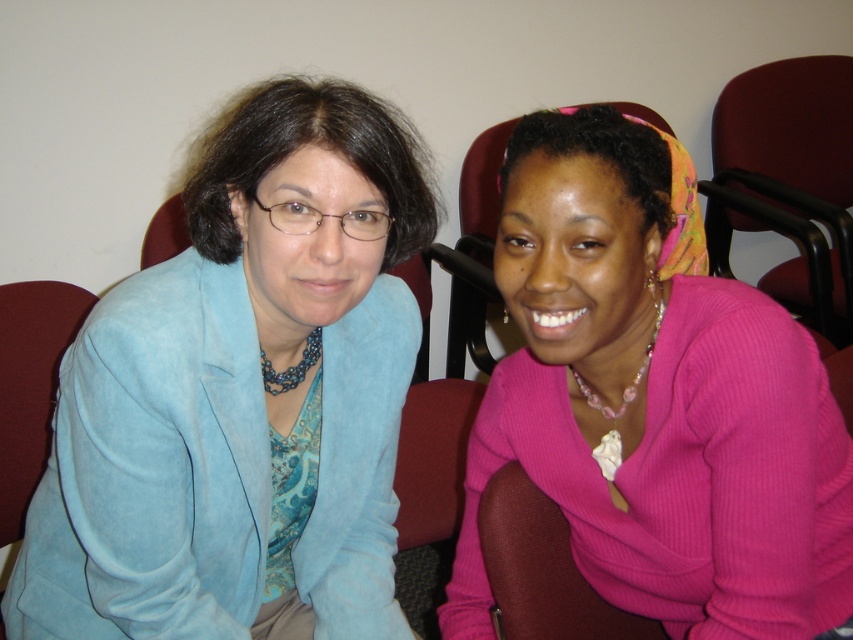
Where is the pink ribbed sweater at center located in the image?

The pink ribbed sweater at center is located at point (654, 404).

You are organizing a photoshoot and need to arrange two outfits for a catalog. The outfits are the suede blue blazer at left and the pink ribbed sweater at center. According to the image, which outfit is positioned to the left of the other?

The suede blue blazer at left is positioned on the left side of the pink ribbed sweater at center.